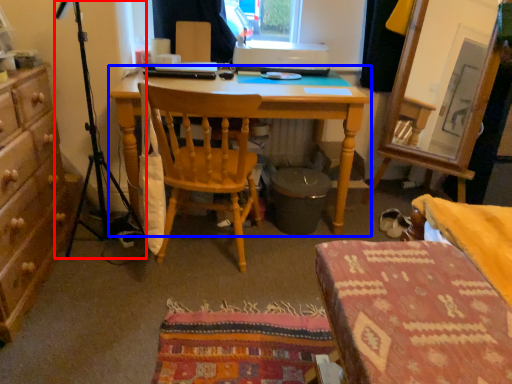
Question: Among these objects, which one is farthest to the camera, tripod (highlighted by a red box) or desk (highlighted by a blue box)?

Choices:
 (A) tripod
 (B) desk

Answer: (B)